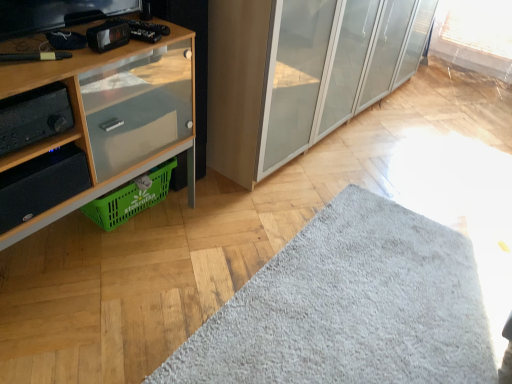
The width and height of the screenshot is (512, 384). Find the location of `vacant region below gray fluffy mat at lower center (from a real-world perspective)`. vacant region below gray fluffy mat at lower center (from a real-world perspective) is located at coordinates (367, 294).